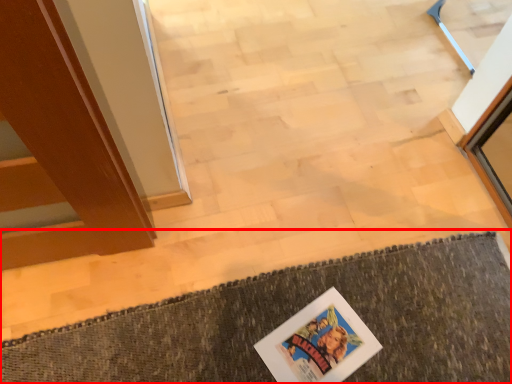
Question: From the image's perspective, where is bath mat (annotated by the red box) located relative to comic book?

Choices:
 (A) above
 (B) below

Answer: (B)